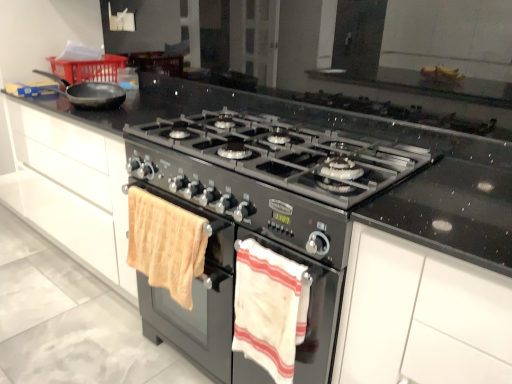
Question: Is white matte cabinet at upper right wider than beige cotton towel at lower left, marked as the 1th beach towel in a left-to-right arrangement?

Choices:
 (A) yes
 (B) no

Answer: (A)

Question: Is white matte cabinet at upper right to the left of beige cotton towel at lower left, marked as the 1th beach towel in a left-to-right arrangement, from the viewer's perspective?

Choices:
 (A) yes
 (B) no

Answer: (B)

Question: Is white matte cabinet at upper right bigger than beige cotton towel at lower left, positioned as the second beach towel in right-to-left order?

Choices:
 (A) yes
 (B) no

Answer: (A)

Question: From the image's perspective, does white matte cabinet at upper right appear higher than beige cotton towel at lower left, marked as the 1th beach towel in a left-to-right arrangement?

Choices:
 (A) no
 (B) yes

Answer: (A)

Question: From the image's perspective, is white matte cabinet at upper right under beige cotton towel at lower left, marked as the 1th beach towel in a left-to-right arrangement?

Choices:
 (A) yes
 (B) no

Answer: (A)

Question: Is white matte cabinet at upper right placed right next to beige cotton towel at lower left, positioned as the second beach towel in right-to-left order?

Choices:
 (A) no
 (B) yes

Answer: (A)

Question: Considering the relative positions of black matte gas stove at center and white striped towel at lower center, the 2th beach towel when ordered from left to right, in the image provided, is black matte gas stove at center to the left of white striped towel at lower center, the 2th beach towel when ordered from left to right, from the viewer's perspective?

Choices:
 (A) no
 (B) yes

Answer: (A)

Question: Considering the relative sizes of black matte gas stove at center and white striped towel at lower center, the 2th beach towel when ordered from left to right, in the image provided, is black matte gas stove at center shorter than white striped towel at lower center, the 2th beach towel when ordered from left to right,?

Choices:
 (A) yes
 (B) no

Answer: (A)

Question: From a real-world perspective, is black matte gas stove at center positioned under white striped towel at lower center, the 2th beach towel when ordered from left to right, based on gravity?

Choices:
 (A) no
 (B) yes

Answer: (A)

Question: Is the position of black matte gas stove at center more distant than that of white striped towel at lower center, the 2th beach towel when ordered from left to right?

Choices:
 (A) yes
 (B) no

Answer: (B)

Question: Does black matte gas stove at center have a larger size compared to white striped towel at lower center, the 2th beach towel when ordered from left to right?

Choices:
 (A) no
 (B) yes

Answer: (B)

Question: Is white striped towel at lower center, the 2th beach towel when ordered from left to right, at the back of black matte gas stove at center?

Choices:
 (A) no
 (B) yes

Answer: (A)

Question: Is white striped towel at lower center, the first beach towel when ordered from right to left, shorter than black matte gas stove at center?

Choices:
 (A) yes
 (B) no

Answer: (B)